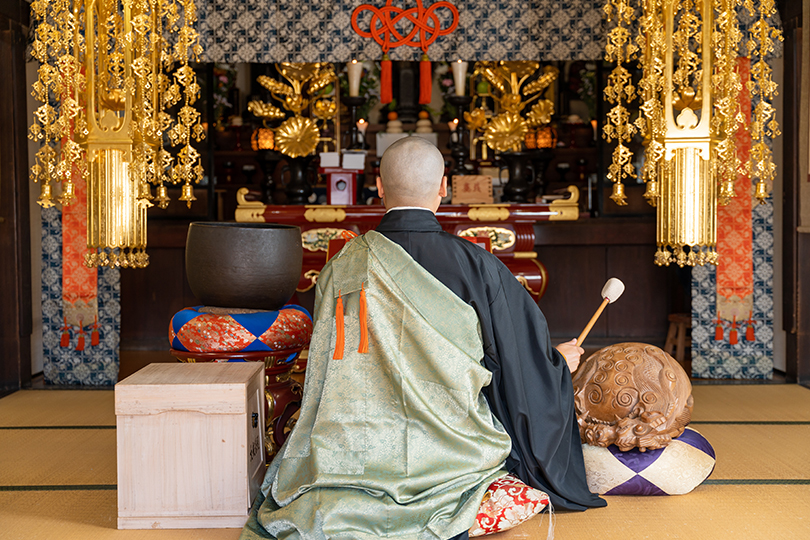
What are the coordinates of `wooden box` in the screenshot? It's located at (184, 445).